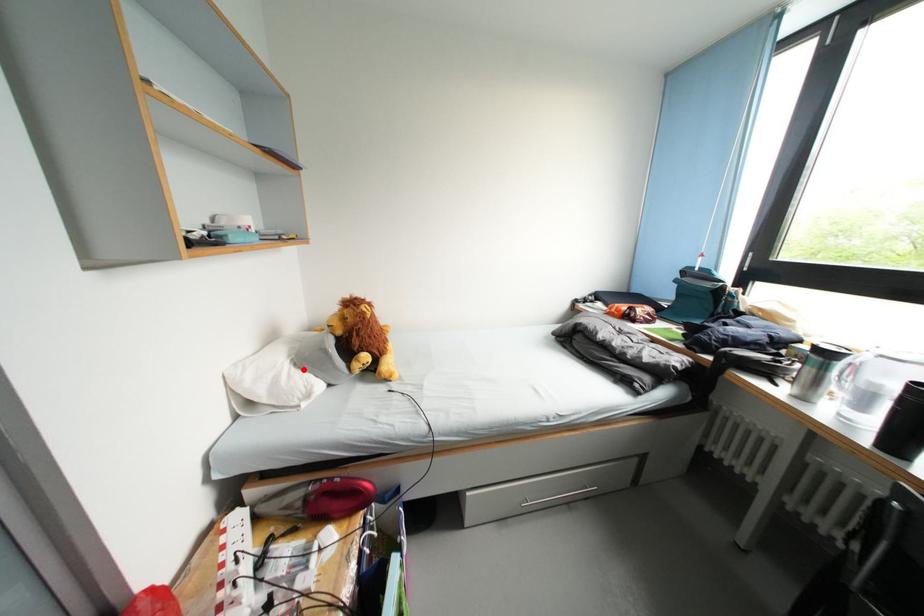
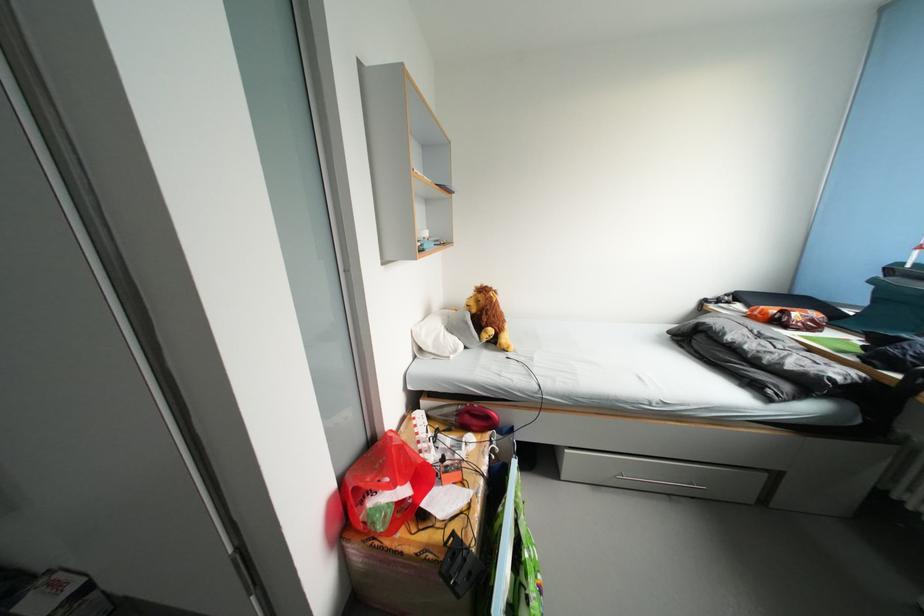
The point at the highlighted location is marked in the first image. Where is the corresponding point in the second image?

(456, 334)